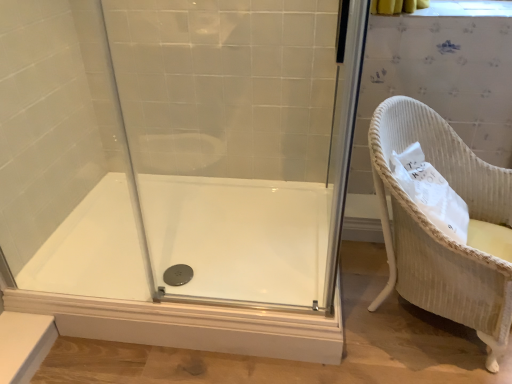
Identify the location of vacant region below white wicker chair at right (from a real-world perspective). The image size is (512, 384). (412, 318).